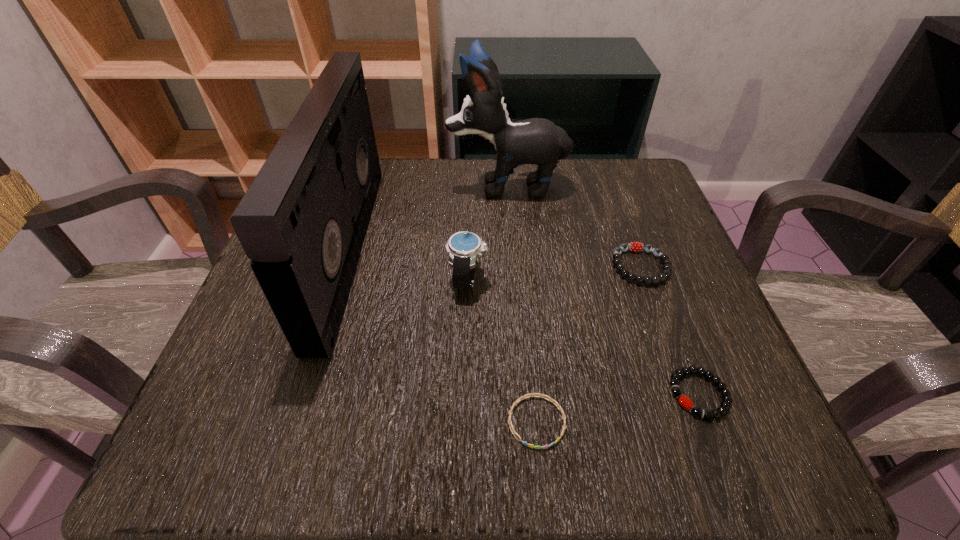
This screenshot has height=540, width=960. I want to click on puppy, so click(x=538, y=141).

Find the location of a particular element. The image size is (960, 540). the leftmost object is located at coordinates (302, 222).

At what (x,y) coordinates should I click in order to perform the action: click on watch. Please return your answer as a coordinate pair (x, y). This screenshot has width=960, height=540. Looking at the image, I should click on (463, 248).

I want to click on the farthest bracelet, so click(664, 258).

Identify the location of the third shortest object. This screenshot has width=960, height=540. (664, 258).

At what (x,y) coordinates should I click in order to perform the action: click on the fifth tallest object. Please return your answer as a coordinate pair (x, y). This screenshot has height=540, width=960. Looking at the image, I should click on (685, 402).

This screenshot has height=540, width=960. Find the location of `the leftmost bracelet`. the leftmost bracelet is located at coordinates (518, 400).

Locate an element on the screen. The image size is (960, 540). the shortest bracelet is located at coordinates (518, 400).

What are the coordinates of `vacant region located on the front-facing side of the puppy` in the screenshot? It's located at (358, 186).

The image size is (960, 540). In order to click on blank space located on the front-facing side of the puppy in this screenshot , I will do click(x=405, y=186).